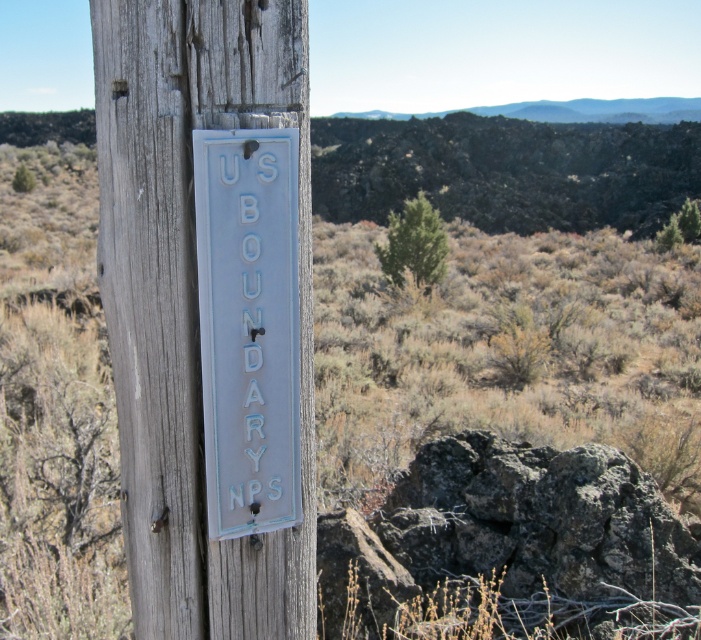
Question: Is white painted wood sign at center to the left of white painted metal sign at center from the viewer's perspective?

Choices:
 (A) yes
 (B) no

Answer: (A)

Question: Which point is farther to the camera?

Choices:
 (A) white painted metal sign at center
 (B) white painted wood sign at center

Answer: (A)

Question: Does white painted wood sign at center have a lesser width compared to white painted metal sign at center?

Choices:
 (A) yes
 (B) no

Answer: (B)

Question: Which of the following is the farthest from the observer?

Choices:
 (A) (229, 268)
 (B) (144, 518)

Answer: (B)

Question: Is white painted wood sign at center positioned at the back of white painted metal sign at center?

Choices:
 (A) yes
 (B) no

Answer: (B)